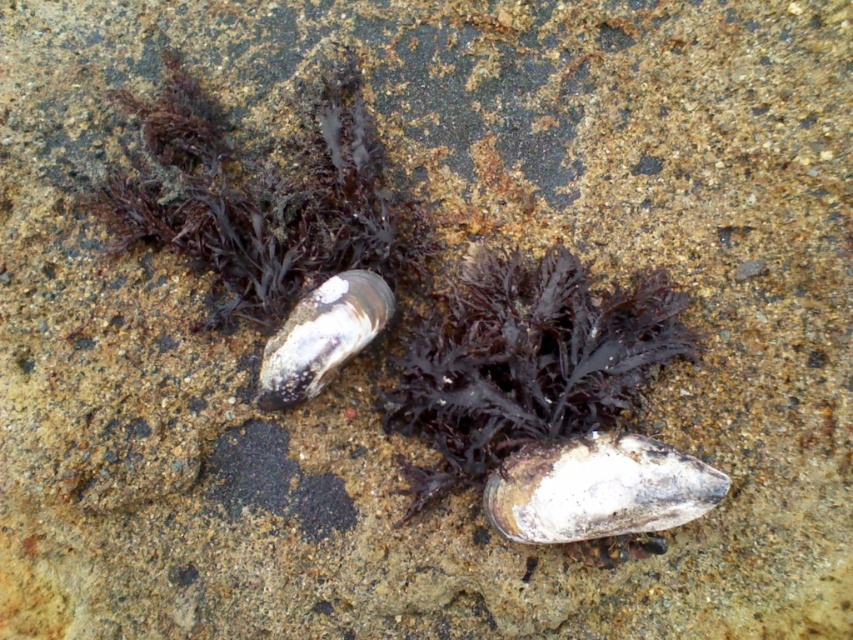
You are a marine biologist observing the image. You need to determine which object is taller between the dark matte seaweed at center and the white matte oyster at center. Based on the scene, which one is taller?

The dark matte seaweed at center is much taller than the white matte oyster at center.

You are a marine biologist measuring the distance between two oysters on a rocky surface. You have a ruler that can measure up to 16 inches. Can you accurately measure the distance between the white matte oyster at center and the white glossy oyster at center with your current ruler?

The white matte oyster at center and white glossy oyster at center are 16.47 inches apart from each other. Since your ruler only measures up to 16 inches, it cannot fully capture the entire distance between them. You will need a longer measuring tool to accurately determine their separation.

Based on the photo, you are observing two points on the image of the mussels. Which point, point (512, 468) or point (280, 340), is closer to you?

Point (512, 468) is closer to the camera than point (280, 340).